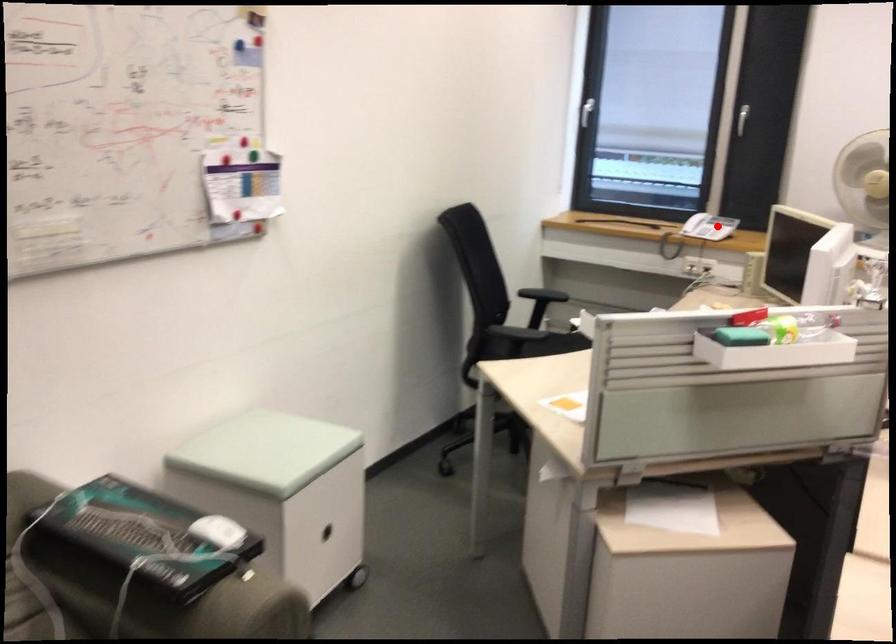
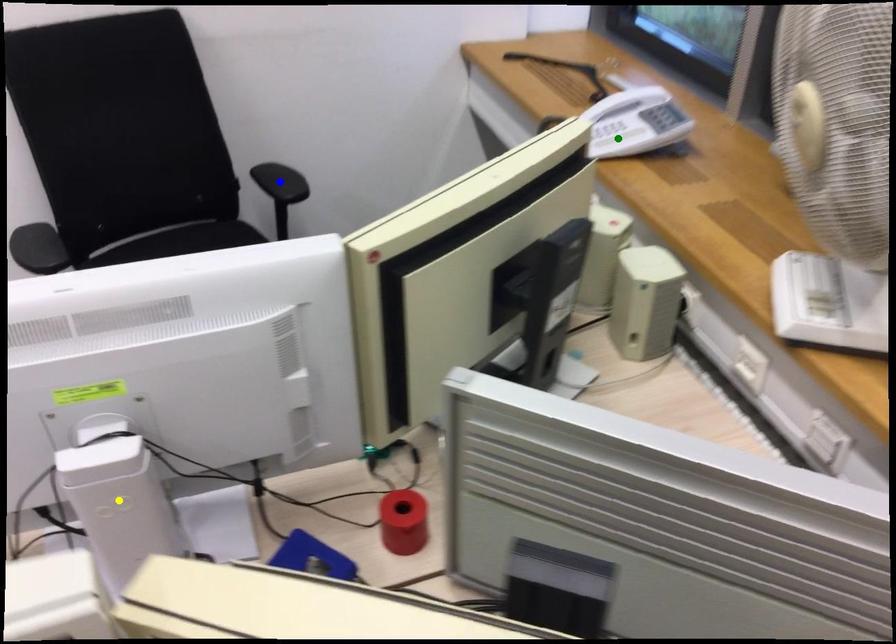
Question: I am providing you with two images of the same scene from different viewpoints. A red point is marked on the first image. You are given multiple points on the second image. Which point in image 2 is actually the same real-world point as the red point in image 1?

Choices:
 (A) blue point
 (B) yellow point
 (C) green point

Answer: (C)